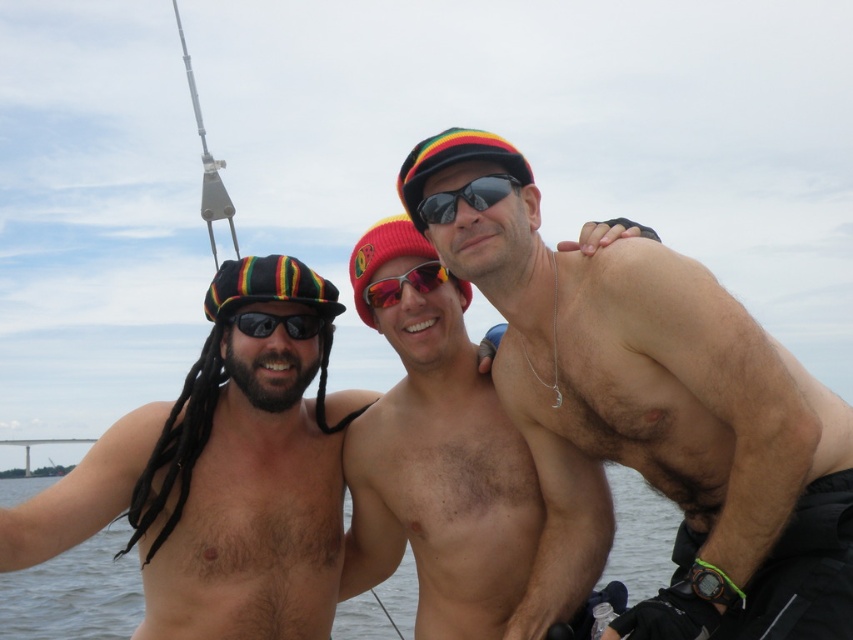
Between red knit beanie at center and reflective plastic sunglasses at center, which one is positioned higher?

Positioned higher is red knit beanie at center.

Is point (352, 257) positioned in front of point (376, 301)?

No, (352, 257) is behind (376, 301).

Which is behind, point (463, 292) or point (408, 269)?

The point (463, 292) is behind.

You are a GUI agent. You are given a task and a screenshot of the screen. Output one action in this format:
    pyautogui.click(x=<x>, y=<y>)
    Task: Click on the red knit beanie at center
    The width and height of the screenshot is (853, 640).
    Given the screenshot: What is the action you would take?
    pyautogui.click(x=383, y=256)

Is point (389, 499) in front of point (431, 289)?

No, (389, 499) is behind (431, 289).

Who is higher up, shiny metallic diver at center or reflective plastic sunglasses at center?

Positioned higher is reflective plastic sunglasses at center.

Between point (525, 566) and point (399, 289), which one is positioned in front?

Positioned in front is point (399, 289).

I want to click on shiny metallic diver at center, so click(x=436, y=456).

Which of these two, rasta-colored fabric hat at left or metallic silver fishing pole at upper left, stands shorter?

Standing shorter between the two is rasta-colored fabric hat at left.

Is rasta-colored fabric hat at left to the left of metallic silver fishing pole at upper left from the viewer's perspective?

Incorrect, rasta-colored fabric hat at left is not on the left side of metallic silver fishing pole at upper left.

Between point (231, 292) and point (183, 36), which one is positioned behind?

Positioned behind is point (183, 36).

Locate an element on the screen. The image size is (853, 640). rasta-colored fabric hat at left is located at coordinates (267, 285).